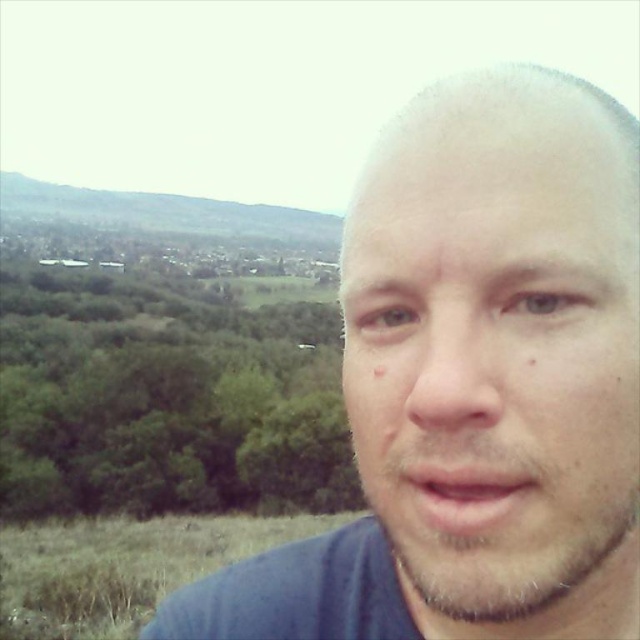
You are a photographer trying to capture the scenic background in the image. You want to ensure the pale skin face at center and the green grassy hillside at upper left are both visible in your shot. Based on their positions, will the face be in front of or behind the hillside?

The pale skin face at center is positioned under green grassy hillside at upper left, so the face is in front of the hillside.

You are a photographer trying to capture the pale skin face at center and the green grassy hillside at upper left in the same frame. Which object is closer to the left edge of the frame?

The green grassy hillside at upper left is closer to the left edge of the frame because the pale skin face at center is positioned on the right side of it.

You are a photographer trying to capture the entire scene in a single photo. Given that the pale skin face at center and the green grassy hillside at upper left are both in your viewfinder, which one will appear smaller in the final photo?

The pale skin face at center will appear smaller in the final photo because it occupies less space than the green grassy hillside at upper left.